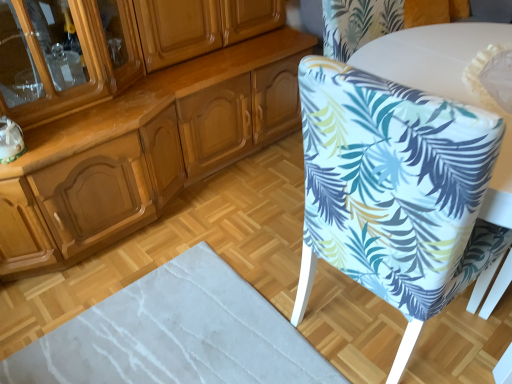
Question: Considering the relative sizes of transparent glass cabinet at upper left and white fabric-covered chair at right in the image provided, is transparent glass cabinet at upper left thinner than white fabric-covered chair at right?

Choices:
 (A) no
 (B) yes

Answer: (B)

Question: Would you say transparent glass cabinet at upper left is outside white fabric-covered chair at right?

Choices:
 (A) no
 (B) yes

Answer: (B)

Question: Does transparent glass cabinet at upper left touch white fabric-covered chair at right?

Choices:
 (A) yes
 (B) no

Answer: (B)

Question: Considering the relative sizes of transparent glass cabinet at upper left and white fabric-covered chair at right in the image provided, is transparent glass cabinet at upper left taller than white fabric-covered chair at right?

Choices:
 (A) no
 (B) yes

Answer: (A)

Question: From the image's perspective, does transparent glass cabinet at upper left appear lower than white fabric-covered chair at right?

Choices:
 (A) no
 (B) yes

Answer: (A)

Question: From a real-world perspective, is white fabric-covered chair at right physically located above or below transparent glass cabinet at upper left?

Choices:
 (A) above
 (B) below

Answer: (B)

Question: Considering the positions of point (445, 297) and point (94, 96), is point (445, 297) closer or farther from the camera than point (94, 96)?

Choices:
 (A) farther
 (B) closer

Answer: (B)

Question: Is white fabric-covered chair at right wider or thinner than transparent glass cabinet at upper left?

Choices:
 (A) thin
 (B) wide

Answer: (B)

Question: Considering the positions of white fabric-covered chair at right and transparent glass cabinet at upper left in the image, is white fabric-covered chair at right taller or shorter than transparent glass cabinet at upper left?

Choices:
 (A) short
 (B) tall

Answer: (B)

Question: From a real-world perspective, is white fabric-covered chair at right positioned above or below white glossy round table at upper right?

Choices:
 (A) below
 (B) above

Answer: (B)

Question: Is white fabric-covered chair at right inside or outside of white glossy round table at upper right?

Choices:
 (A) inside
 (B) outside

Answer: (B)

Question: From their relative heights in the image, would you say white fabric-covered chair at right is taller or shorter than white glossy round table at upper right?

Choices:
 (A) tall
 (B) short

Answer: (B)

Question: From the image's perspective, is white fabric-covered chair at right positioned above or below white glossy round table at upper right?

Choices:
 (A) below
 (B) above

Answer: (A)

Question: Considering their positions, is white glossy round table at upper right located in front of or behind transparent glass cabinet at upper left?

Choices:
 (A) behind
 (B) front

Answer: (A)

Question: From the image's perspective, relative to transparent glass cabinet at upper left, is white glossy round table at upper right above or below?

Choices:
 (A) above
 (B) below

Answer: (B)